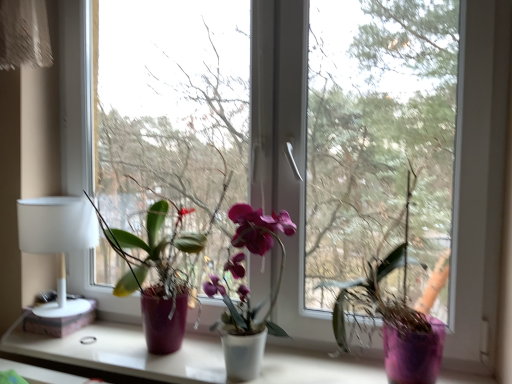
Question: From a real-world perspective, is transparent glass window at center physically above matte purple pot at left, the third houseplant positioned from the right?

Choices:
 (A) yes
 (B) no

Answer: (A)

Question: Considering the relative sizes of transparent glass window at center and matte purple pot at left, the 1th houseplant from the left, in the image provided, is transparent glass window at center taller than matte purple pot at left, the 1th houseplant from the left,?

Choices:
 (A) no
 (B) yes

Answer: (B)

Question: Is there a large distance between transparent glass window at center and matte purple pot at left, the third houseplant positioned from the right?

Choices:
 (A) yes
 (B) no

Answer: (B)

Question: Would you say transparent glass window at center contains matte purple pot at left, the 1th houseplant from the left?

Choices:
 (A) yes
 (B) no

Answer: (B)

Question: Could you tell me if transparent glass window at center is turned towards matte purple pot at left, the third houseplant positioned from the right?

Choices:
 (A) yes
 (B) no

Answer: (A)

Question: Considering the relative sizes of transparent glass window at center and matte purple pot at left, the third houseplant positioned from the right, in the image provided, is transparent glass window at center bigger than matte purple pot at left, the third houseplant positioned from the right,?

Choices:
 (A) no
 (B) yes

Answer: (B)

Question: Considering the relative sizes of white matte window sill at center and transparent glass window at center in the image provided, is white matte window sill at center thinner than transparent glass window at center?

Choices:
 (A) yes
 (B) no

Answer: (B)

Question: Is the depth of white matte window sill at center greater than that of transparent glass window at center?

Choices:
 (A) yes
 (B) no

Answer: (B)

Question: Can you confirm if white matte window sill at center is taller than transparent glass window at center?

Choices:
 (A) yes
 (B) no

Answer: (B)

Question: Considering the relative sizes of white matte window sill at center and transparent glass window at center in the image provided, is white matte window sill at center smaller than transparent glass window at center?

Choices:
 (A) yes
 (B) no

Answer: (A)

Question: Does white matte window sill at center turn towards transparent glass window at center?

Choices:
 (A) no
 (B) yes

Answer: (A)

Question: Can you confirm if white matte window sill at center is shorter than transparent glass window at center?

Choices:
 (A) no
 (B) yes

Answer: (B)

Question: Does purple matte vase at center, the 3th houseplant viewed from the left, contain white matte table lamp at left?

Choices:
 (A) no
 (B) yes

Answer: (A)